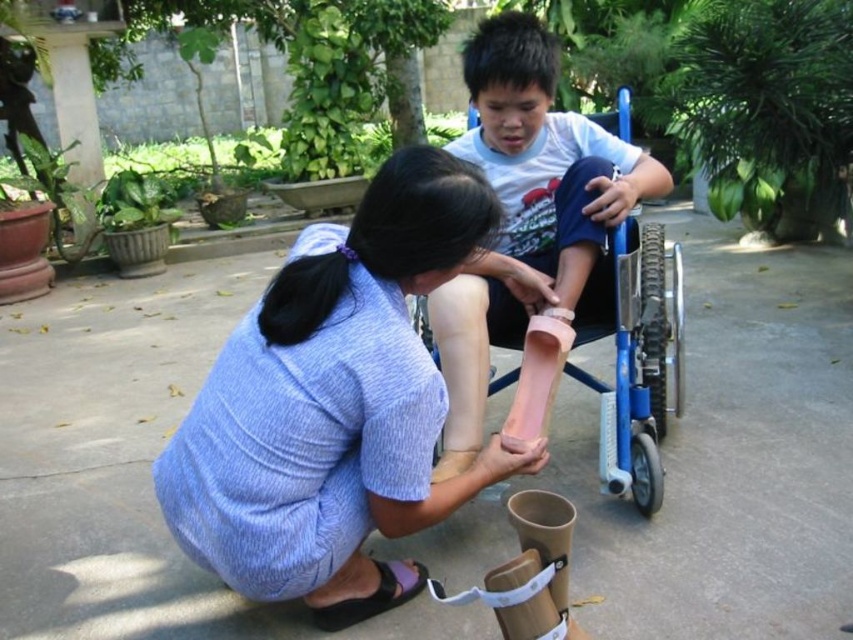
A person is trying to reach an object located at the same position as the pink matte prosthetic leg at center. They are currently standing at the position of the matte blue dress at center. How should they move to reach the object?

The matte blue dress at center is located below the pink matte prosthetic leg at center, so the person should move upward to reach the object.

You are a physical therapist helping a patient choose between the pink matte prosthetic leg at center and the black fabric sandal at lower center. The patient wants to know which item is closer to their current position. Can you determine which one is nearer?

The distance between the pink matte prosthetic leg at center and the black fabric sandal at lower center is 21.40 inches. Since the question is about proximity to the patient, we need to know their exact position in the scene. However, based on the given information, the prosthetic leg and sandal are 21.40 inches apart, but without knowing where the patient is sitting, we can only state the distance between them. The patient is likely seated in the wheelchair, so if the wheelchair is positioned such that...

You are a physical therapist helping a patient choose between a prosthetic leg and a sandal. Based on the image, which item is larger in size and thus might be more suitable for a larger foot? Please refer to the pink matte prosthetic leg at center and the black fabric sandal at lower center in your answer.

The pink matte prosthetic leg at center is bigger than the black fabric sandal at lower center, so it might be more suitable for a larger foot.